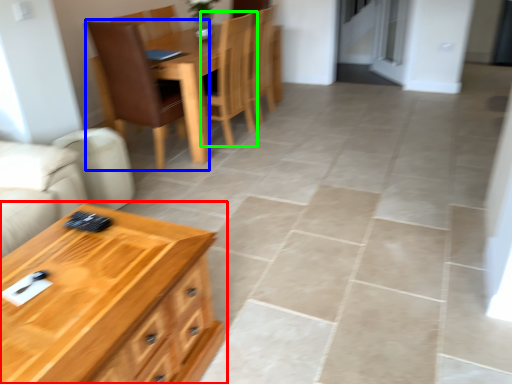
Question: Which object is positioned closest to table (highlighted by a red box)? Select from chair (highlighted by a blue box) and chair (highlighted by a green box).

Choices:
 (A) chair
 (B) chair

Answer: (A)